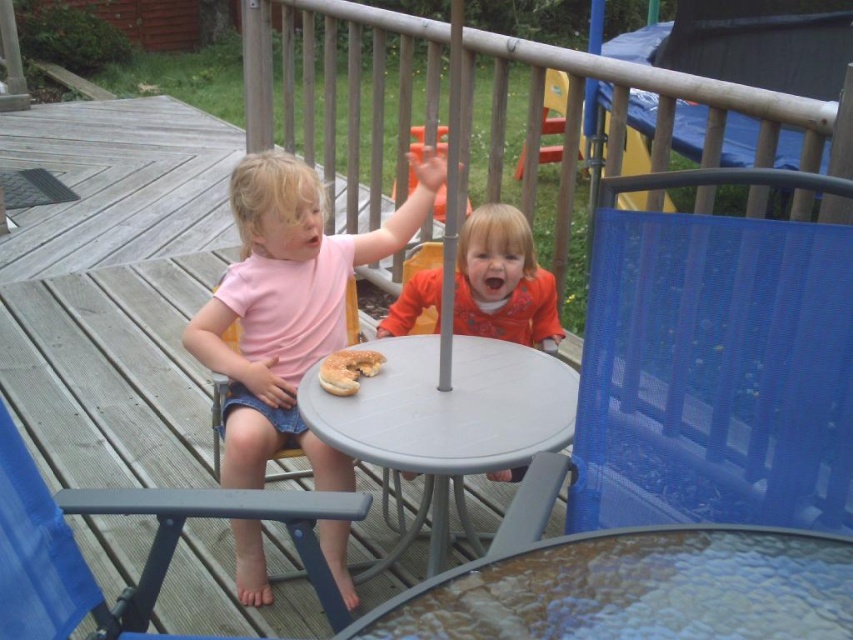
Which is more to the left, pink matte shirt at center or orange matte shirt at center?

From the viewer's perspective, pink matte shirt at center appears more on the left side.

Is pink matte shirt at center further to camera compared to orange matte shirt at center?

That is False.

Who is more distant from viewer, (335, 528) or (381, 323)?

The point (381, 323) is behind.

Find the location of `pink matte shirt at center`. pink matte shirt at center is located at coordinates (288, 307).

In the scene shown: Who is more distant from viewer, (434, 168) or (491, 349)?

Positioned behind is point (434, 168).

What do you see at coordinates (288, 307) in the screenshot? I see `pink matte shirt at center` at bounding box center [288, 307].

Image resolution: width=853 pixels, height=640 pixels. Identify the location of pink matte shirt at center. (288, 307).

The height and width of the screenshot is (640, 853). Describe the element at coordinates (448, 406) in the screenshot. I see `gray plastic table at center` at that location.

Does point (331, 420) come in front of point (128, 502)?

No, it is not.

You are a GUI agent. You are given a task and a screenshot of the screen. Output one action in this format:
    pyautogui.click(x=<x>, y=<y>)
    Task: Click on the gray plastic table at center
    This screenshot has width=853, height=640.
    Given the screenshot: What is the action you would take?
    pyautogui.click(x=448, y=406)